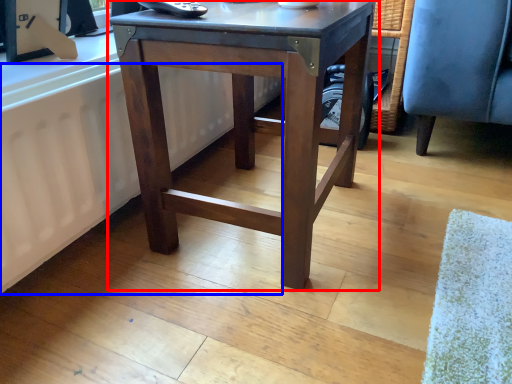
Question: Which point is further to the camera, table (highlighted by a red box) or radiator (highlighted by a blue box)?

Choices:
 (A) table
 (B) radiator

Answer: (B)